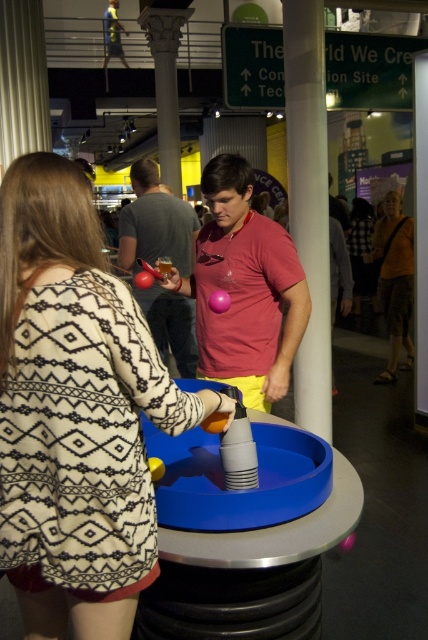
Question: Which object is the farthest from the pink rubber ball at center?

Choices:
 (A) orange fabric shirt at right
 (B) matte pink ball at center
 (C) patterned sweater at center

Answer: (A)

Question: Does patterned sweater at center appear over pink rubber ball at center?

Choices:
 (A) yes
 (B) no

Answer: (B)

Question: Does patterned sweater at center appear under pink rubber ball at center?

Choices:
 (A) yes
 (B) no

Answer: (A)

Question: Which point is closer to the camera?

Choices:
 (A) (297, 314)
 (B) (121, 346)

Answer: (B)

Question: Which point is closer to the camera?

Choices:
 (A) (14, 538)
 (B) (220, 372)

Answer: (A)

Question: Does patterned sweater at center appear over pink rubber ball at center?

Choices:
 (A) yes
 (B) no

Answer: (B)